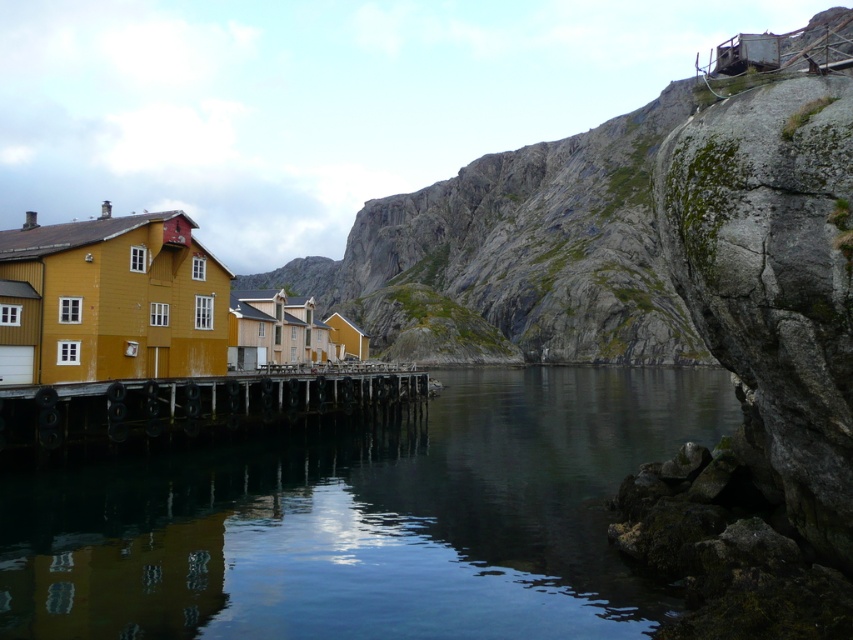
Question: Is clear water at center smaller than wooden planks at center?

Choices:
 (A) no
 (B) yes

Answer: (A)

Question: Where is clear water at center located in relation to wooden planks at center in the image?

Choices:
 (A) below
 (B) above

Answer: (A)

Question: Which point is farther from the camera taking this photo?

Choices:
 (A) (318, 368)
 (B) (436, 592)

Answer: (A)

Question: Does clear water at center lie behind wooden planks at center?

Choices:
 (A) yes
 (B) no

Answer: (B)

Question: Which point is closer to the camera taking this photo?

Choices:
 (A) (421, 392)
 (B) (457, 468)

Answer: (B)